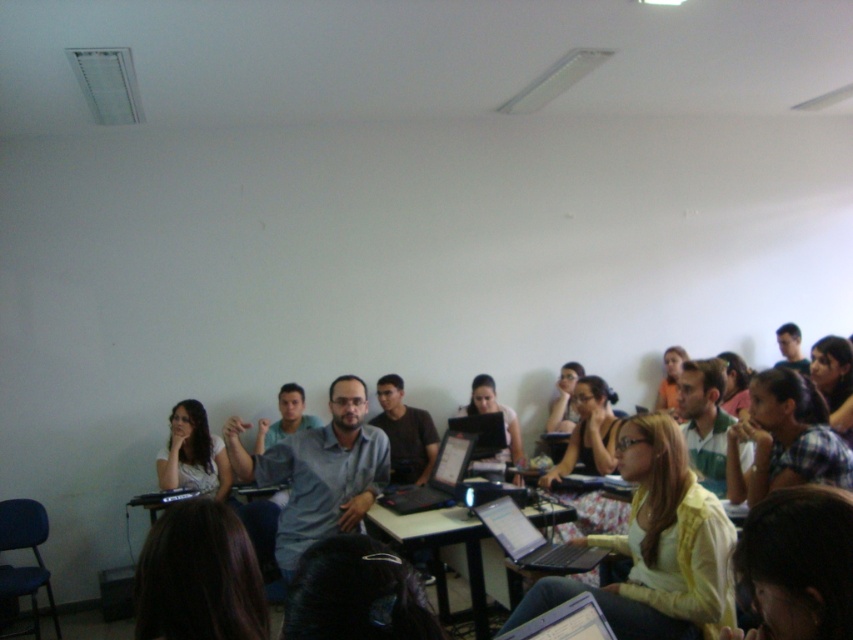
From the picture: Is matte yellow sweater at center wider than silver metallic laptop at lower center?

Correct, the width of matte yellow sweater at center exceeds that of silver metallic laptop at lower center.

Does point (663, 500) lie behind point (514, 627)?

Yes, point (663, 500) is farther from viewer.

At what (x,y) coordinates should I click in order to perform the action: click on matte yellow sweater at center. Please return your answer as a coordinate pair (x, y). Image resolution: width=853 pixels, height=640 pixels. Looking at the image, I should click on (656, 547).

Can you confirm if matte yellow sweater at center is positioned above black glossy laptop at center?

Actually, matte yellow sweater at center is below black glossy laptop at center.

How much distance is there between matte yellow sweater at center and black glossy laptop at center?

matte yellow sweater at center and black glossy laptop at center are 38.15 inches apart.

I want to click on matte yellow sweater at center, so [656, 547].

Image resolution: width=853 pixels, height=640 pixels. What are the coordinates of `matte yellow sweater at center` in the screenshot? It's located at (656, 547).

Can you confirm if silver metallic laptop at center is smaller than silver metallic laptop at lower center?

Actually, silver metallic laptop at center might be larger than silver metallic laptop at lower center.

Is silver metallic laptop at center above silver metallic laptop at lower center?

No, silver metallic laptop at center is not above silver metallic laptop at lower center.

At what (x,y) coordinates should I click in order to perform the action: click on silver metallic laptop at center. Please return your answer as a coordinate pair (x, y). Looking at the image, I should click on (532, 541).

Where is `silver metallic laptop at center`? Image resolution: width=853 pixels, height=640 pixels. silver metallic laptop at center is located at coordinates (532, 541).